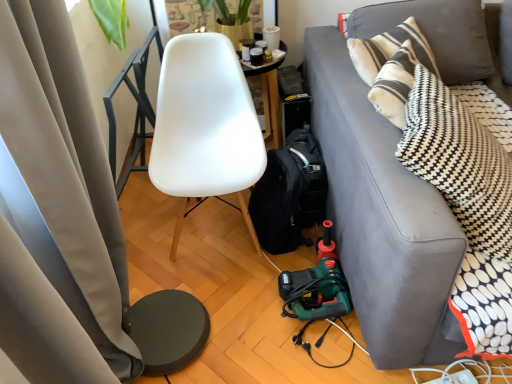
Question: From the image's perspective, is gray fabric couch at right above black fabric backpack at lower center?

Choices:
 (A) yes
 (B) no

Answer: (A)

Question: Is gray fabric couch at right positioned beyond the bounds of black fabric backpack at lower center?

Choices:
 (A) no
 (B) yes

Answer: (B)

Question: From a real-world perspective, is gray fabric couch at right beneath black fabric backpack at lower center?

Choices:
 (A) yes
 (B) no

Answer: (B)

Question: Considering the relative sizes of gray fabric couch at right and black fabric backpack at lower center in the image provided, is gray fabric couch at right smaller than black fabric backpack at lower center?

Choices:
 (A) yes
 (B) no

Answer: (B)

Question: Can you see gray fabric couch at right touching black fabric backpack at lower center?

Choices:
 (A) yes
 (B) no

Answer: (B)

Question: In the image, is black fabric backpack at lower center positioned in front of or behind gray fabric couch at right?

Choices:
 (A) behind
 (B) front

Answer: (A)

Question: Based on their positions, is black fabric backpack at lower center located to the left or right of gray fabric couch at right?

Choices:
 (A) left
 (B) right

Answer: (A)

Question: From the image's perspective, is black fabric backpack at lower center located above or below gray fabric couch at right?

Choices:
 (A) above
 (B) below

Answer: (B)

Question: Is point (318, 218) closer or farther from the camera than point (350, 81)?

Choices:
 (A) closer
 (B) farther

Answer: (B)

Question: From a real-world perspective, is white plastic power outlet at lower right physically located above or below matte gray curtain at left?

Choices:
 (A) above
 (B) below

Answer: (B)

Question: In the image, is white plastic power outlet at lower right on the left side or the right side of matte gray curtain at left?

Choices:
 (A) left
 (B) right

Answer: (B)

Question: Considering the positions of white plastic power outlet at lower right and matte gray curtain at left in the image, is white plastic power outlet at lower right wider or thinner than matte gray curtain at left?

Choices:
 (A) wide
 (B) thin

Answer: (B)

Question: From the image's perspective, is white plastic power outlet at lower right located above or below matte gray curtain at left?

Choices:
 (A) below
 (B) above

Answer: (A)

Question: Is matte gray curtain at left to the left or to the right of white matte chair at center in the image?

Choices:
 (A) left
 (B) right

Answer: (A)

Question: Considering the positions of matte gray curtain at left and white matte chair at center in the image, is matte gray curtain at left taller or shorter than white matte chair at center?

Choices:
 (A) tall
 (B) short

Answer: (A)